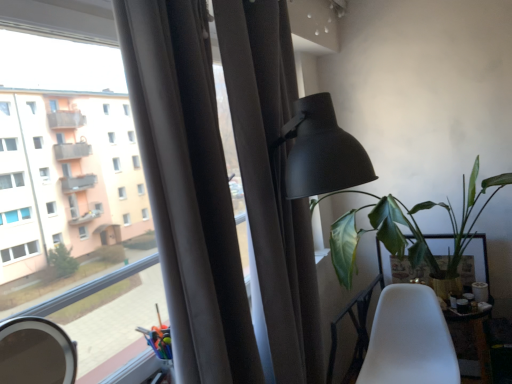
Question: Can you see wooden table at lower right, which is the 2th table from back to front, touching matte black lamp at upper right?

Choices:
 (A) no
 (B) yes

Answer: (A)

Question: Is wooden table at lower right, which is the 2th table from back to front, at the right side of matte black lamp at upper right?

Choices:
 (A) yes
 (B) no

Answer: (A)

Question: Does wooden table at lower right, which appears as the 1th table when viewed from the front, have a larger size compared to matte black lamp at upper right?

Choices:
 (A) yes
 (B) no

Answer: (B)

Question: Does wooden table at lower right, which is the 2th table from back to front, come behind matte black lamp at upper right?

Choices:
 (A) no
 (B) yes

Answer: (B)

Question: Is wooden table at lower right, which is the 2th table from back to front, positioned in front of matte black lamp at upper right?

Choices:
 (A) yes
 (B) no

Answer: (B)

Question: Considering the positions of point (314, 104) and point (420, 380), is point (314, 104) closer or farther from the camera than point (420, 380)?

Choices:
 (A) closer
 (B) farther

Answer: (A)

Question: From the image's perspective, relative to white matte chair at lower right, is matte black lamp at upper right above or below?

Choices:
 (A) below
 (B) above

Answer: (B)

Question: Relative to white matte chair at lower right, is matte black lamp at upper right in front or behind?

Choices:
 (A) behind
 (B) front

Answer: (B)

Question: Looking at their shapes, would you say matte black lamp at upper right is wider or thinner than white matte chair at lower right?

Choices:
 (A) thin
 (B) wide

Answer: (A)

Question: In terms of size, does matte black mirror at lower left appear bigger or smaller than matte gray curtain at center?

Choices:
 (A) big
 (B) small

Answer: (B)

Question: Is matte black mirror at lower left spatially inside matte gray curtain at center, or outside of it?

Choices:
 (A) inside
 (B) outside

Answer: (B)

Question: In terms of width, does matte black mirror at lower left look wider or thinner when compared to matte gray curtain at center?

Choices:
 (A) wide
 (B) thin

Answer: (B)

Question: Is matte black mirror at lower left in front of or behind matte gray curtain at center in the image?

Choices:
 (A) behind
 (B) front

Answer: (A)

Question: Is point coord(456,327) closer or farther from the camera than point coord(379,226)?

Choices:
 (A) closer
 (B) farther

Answer: (B)

Question: Considering the positions of wooden table at lower right, which is the 2th table from back to front, and green leafy plant at right in the image, is wooden table at lower right, which is the 2th table from back to front, wider or thinner than green leafy plant at right?

Choices:
 (A) thin
 (B) wide

Answer: (A)